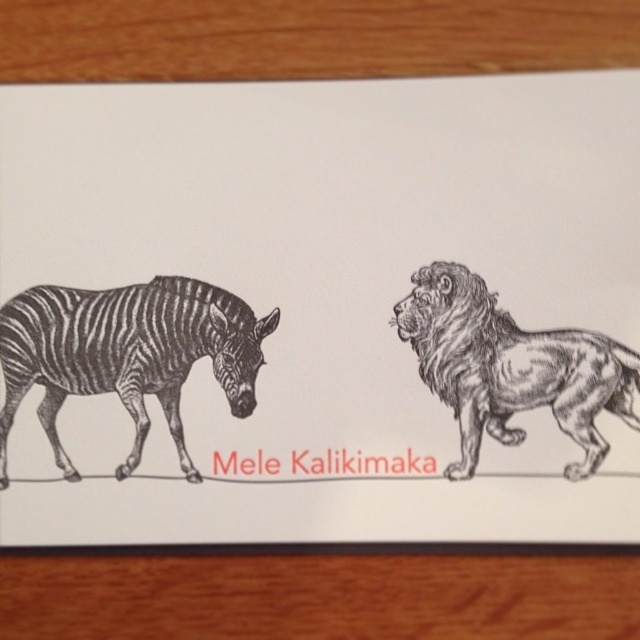
Question: Among these points, which one is farthest from the camera?

Choices:
 (A) (492, 360)
 (B) (116, 364)

Answer: (B)

Question: Which point appears closest to the camera in this image?

Choices:
 (A) (216, 289)
 (B) (428, 371)

Answer: (B)

Question: In this image, where is black and white striped zebra at left located relative to black ink lion at right?

Choices:
 (A) below
 (B) above

Answer: (B)

Question: Is black and white striped zebra at left above black ink lion at right?

Choices:
 (A) yes
 (B) no

Answer: (A)

Question: Is black and white striped zebra at left thinner than black ink lion at right?

Choices:
 (A) yes
 (B) no

Answer: (B)